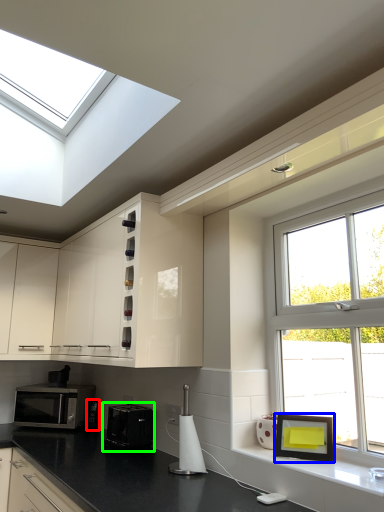
Question: Which object is positioned farthest from appliance (highlighted by a red box)? Select from picture frame (highlighted by a blue box) and appliance (highlighted by a green box).

Choices:
 (A) picture frame
 (B) appliance

Answer: (A)